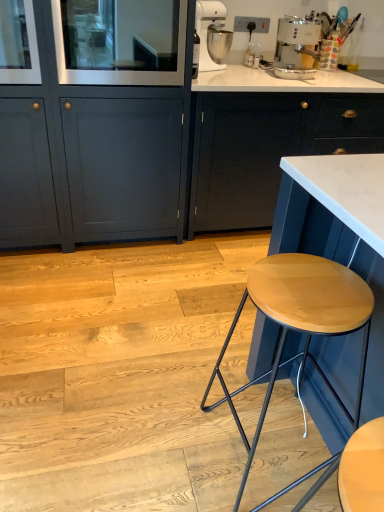
Question: Should I look upward or downward to see matte gray cabinet at lower left, positioned as the 1th cabinetry in left-to-right order?

Choices:
 (A) up
 (B) down

Answer: (A)

Question: Is white glossy coffee machine at upper right positioned in front of matte dark blue cabinet at center, marked as the second cabinetry in a left-to-right arrangement?

Choices:
 (A) no
 (B) yes

Answer: (A)

Question: From the image's perspective, does white glossy coffee machine at upper right appear lower than matte dark blue cabinet at center, the 1th cabinetry when ordered from right to left?

Choices:
 (A) yes
 (B) no

Answer: (B)

Question: From a real-world perspective, does white glossy coffee machine at upper right sit lower than matte dark blue cabinet at center, marked as the second cabinetry in a left-to-right arrangement?

Choices:
 (A) yes
 (B) no

Answer: (B)

Question: Is white glossy coffee machine at upper right outside matte dark blue cabinet at center, marked as the second cabinetry in a left-to-right arrangement?

Choices:
 (A) yes
 (B) no

Answer: (A)

Question: Is white glossy coffee machine at upper right taller than matte dark blue cabinet at center, marked as the second cabinetry in a left-to-right arrangement?

Choices:
 (A) no
 (B) yes

Answer: (A)

Question: Considering the relative positions of white glossy coffee machine at upper right and matte dark blue cabinet at center, the 1th cabinetry when ordered from right to left, in the image provided, is white glossy coffee machine at upper right to the right of matte dark blue cabinet at center, the 1th cabinetry when ordered from right to left, from the viewer's perspective?

Choices:
 (A) no
 (B) yes

Answer: (A)

Question: Does white glossy coffee machine at upper right contain clear glass door at upper left?

Choices:
 (A) yes
 (B) no

Answer: (B)

Question: Is white glossy coffee machine at upper right smaller than clear glass door at upper left?

Choices:
 (A) yes
 (B) no

Answer: (A)

Question: Does white glossy coffee machine at upper right lie in front of clear glass door at upper left?

Choices:
 (A) no
 (B) yes

Answer: (A)

Question: Is white glossy coffee machine at upper right turned away from clear glass door at upper left?

Choices:
 (A) yes
 (B) no

Answer: (B)

Question: Is white glossy coffee machine at upper right bigger than clear glass door at upper left?

Choices:
 (A) no
 (B) yes

Answer: (A)

Question: Does white glossy coffee machine at upper right lie behind clear glass door at upper left?

Choices:
 (A) no
 (B) yes

Answer: (B)

Question: Does white metallic stand mixer at upper center have a lesser height compared to matte dark blue cabinet at center, the 1th cabinetry when ordered from right to left?

Choices:
 (A) no
 (B) yes

Answer: (B)